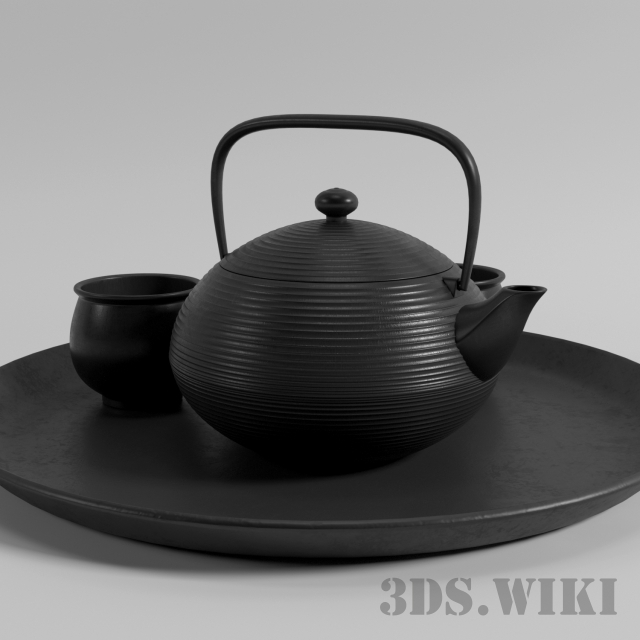
Identify the location of handle of kettle. Image resolution: width=640 pixels, height=640 pixels. [x=331, y=120].